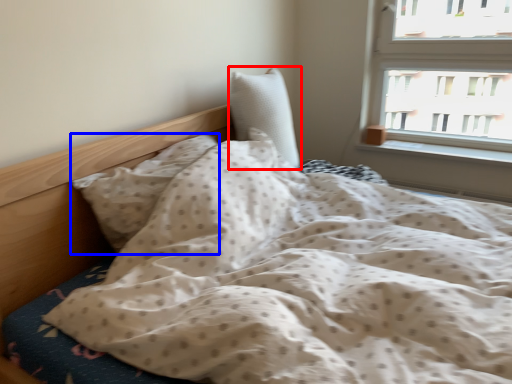
Question: Which point is further to the camera, pillow (highlighted by a red box) or pillow (highlighted by a blue box)?

Choices:
 (A) pillow
 (B) pillow

Answer: (A)